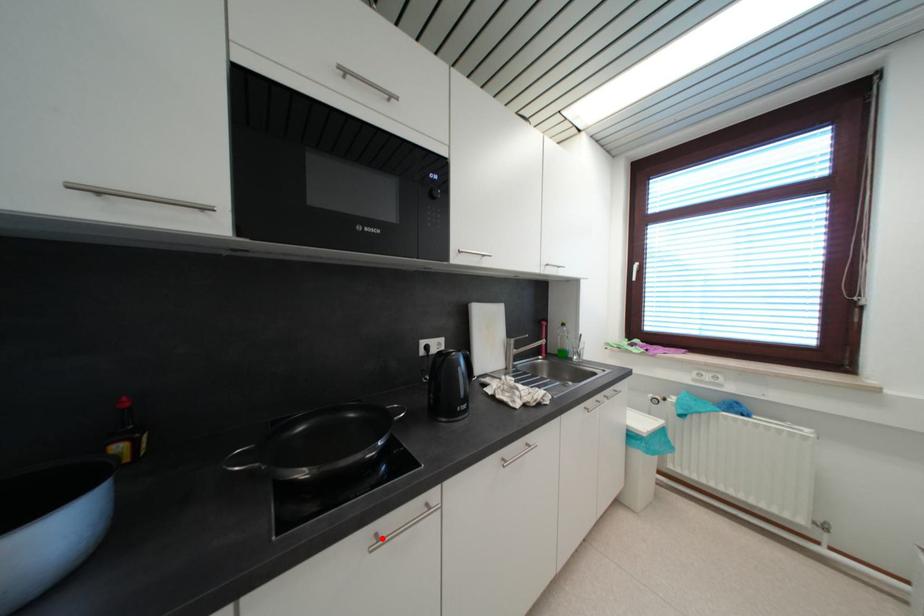
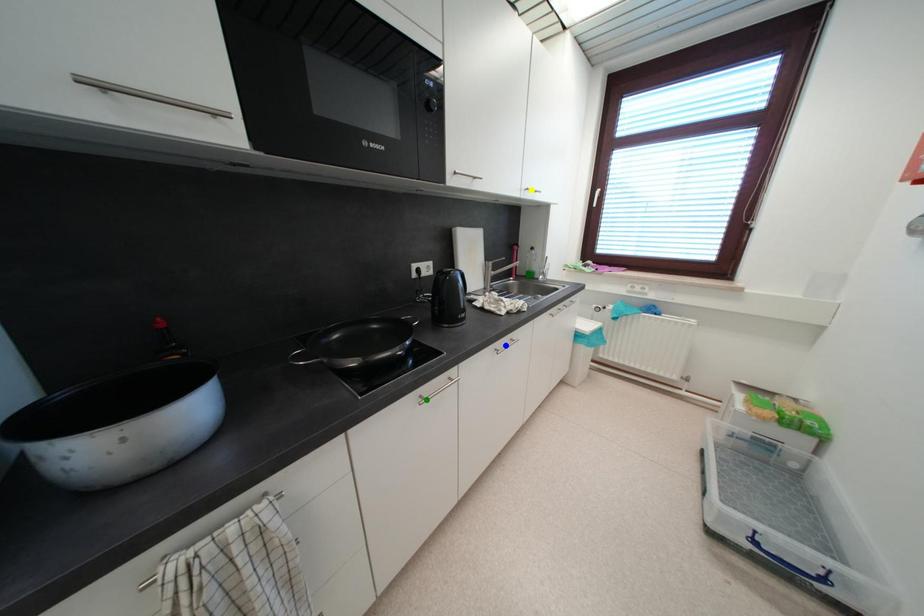
Question: I am providing you with two images of the same scene from different viewpoints. A red point is marked on the first image. You are given multiple points on the second image. Which spot in image 2 lines up with the point in image 1?

Choices:
 (A) blue point
 (B) green point
 (C) yellow point

Answer: (B)